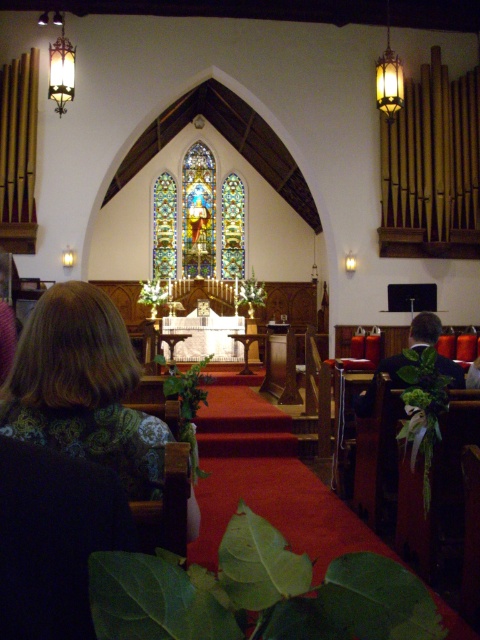
You are a photographer wanting to capture the entire scene of the church altar. You notice the brown textured hair at lower left and the stained glass at center. Which object is wider in the image?

The brown textured hair at lower left is wider than the stained glass at center in the image.

You are standing at the back of the church and want to see both the brown textured hair at lower left and the stained glass at center. Which object appears taller from your current position?

The brown textured hair at lower left appears taller than the stained glass at center because it has a greater height compared to the stained glass at center.